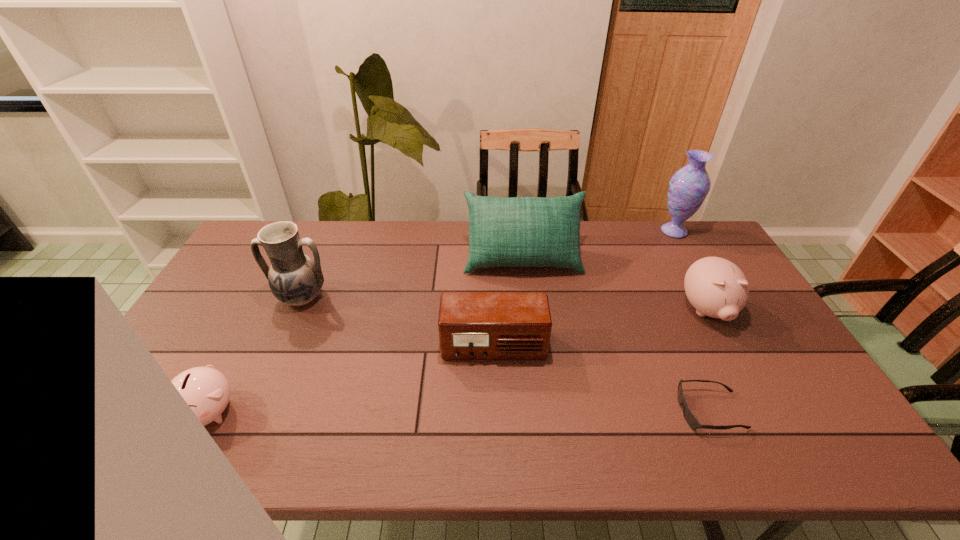
Locate an element on the screen. The image size is (960, 540). piggy bank positioned at the near edge is located at coordinates (206, 390).

At what (x,y) coordinates should I click in order to perform the action: click on sunglasses that is positioned at the near edge. Please return your answer as a coordinate pair (x, y). This screenshot has height=540, width=960. Looking at the image, I should click on (689, 417).

At what (x,y) coordinates should I click in order to perform the action: click on object situated at the left edge. Please return your answer as a coordinate pair (x, y). Looking at the image, I should click on (206, 390).

Identify the location of vase located in the right edge section of the desktop. (688, 188).

You are a GUI agent. You are given a task and a screenshot of the screen. Output one action in this format:
    pyautogui.click(x=<x>, y=<y>)
    Task: Click on the piggy bank that is positioned at the right edge
    The image size is (960, 540).
    Given the screenshot: What is the action you would take?
    pyautogui.click(x=716, y=287)

You are a GUI agent. You are given a task and a screenshot of the screen. Output one action in this format:
    pyautogui.click(x=<x>, y=<y>)
    Task: Click on the object at the near left corner
    The image size is (960, 540).
    Given the screenshot: What is the action you would take?
    pyautogui.click(x=206, y=390)

Where is `object that is at the far right corner`? The width and height of the screenshot is (960, 540). object that is at the far right corner is located at coordinates (688, 188).

Locate an element on the screen. Image resolution: width=960 pixels, height=540 pixels. vacant space at the far edge is located at coordinates click(656, 221).

In the image, there is a desktop. Where is `vacant space at the near edge`? The width and height of the screenshot is (960, 540). vacant space at the near edge is located at coordinates (710, 444).

The image size is (960, 540). I want to click on free space at the left edge of the desktop, so click(x=180, y=410).